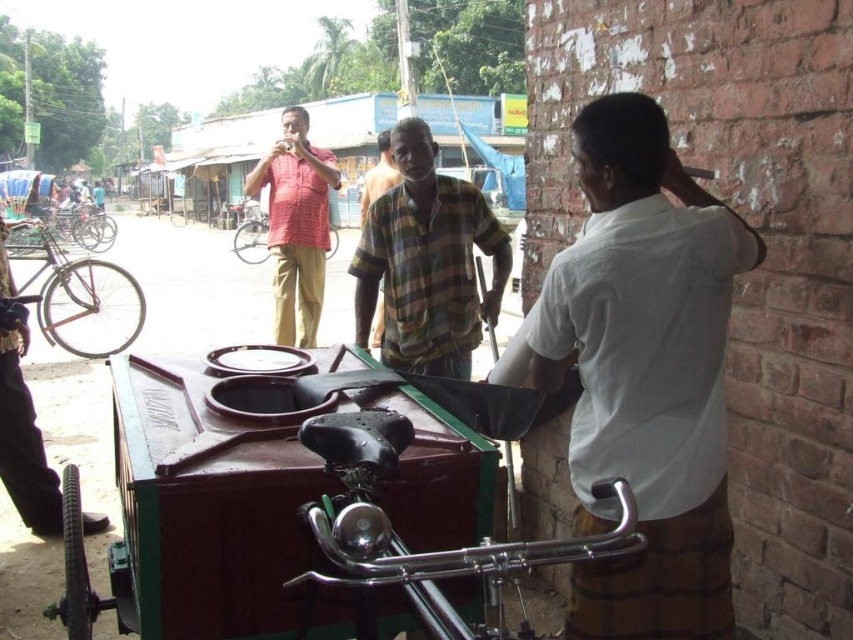
Question: Can you confirm if white cotton shirt at right is smaller than matte red shirt at center?

Choices:
 (A) yes
 (B) no

Answer: (B)

Question: Does plaid cotton shirt at center appear on the right side of checkered fabric shirt at center?

Choices:
 (A) no
 (B) yes

Answer: (B)

Question: Which point is closer to the camera taking this photo?

Choices:
 (A) (637, 140)
 (B) (460, 358)
 (C) (450, 596)

Answer: (A)

Question: Which point is closer to the camera taking this photo?

Choices:
 (A) (334, 163)
 (B) (328, 448)
 (C) (578, 493)

Answer: (B)

Question: Among these points, which one is nearest to the camera?

Choices:
 (A) pyautogui.click(x=339, y=528)
 (B) pyautogui.click(x=285, y=115)
 (C) pyautogui.click(x=479, y=205)
 (D) pyautogui.click(x=672, y=477)

Answer: (A)

Question: Does white cotton shirt at right have a lesser width compared to matte red shirt at center?

Choices:
 (A) no
 (B) yes

Answer: (A)